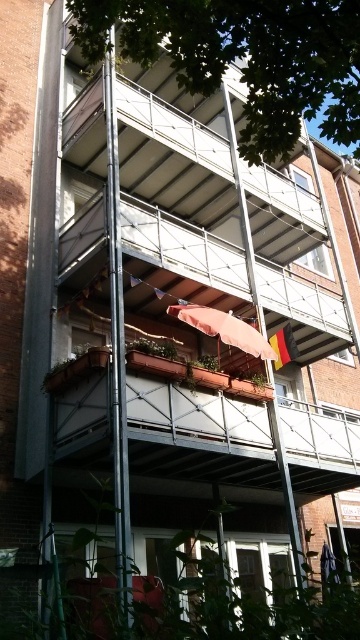
Question: Can you confirm if green leafy tree at upper center is positioned to the left of matte pink fabric canopy at center?

Choices:
 (A) yes
 (B) no

Answer: (A)

Question: Can you confirm if green leafy tree at upper center is positioned below matte pink fabric canopy at center?

Choices:
 (A) yes
 (B) no

Answer: (B)

Question: Which point appears farthest from the camera in this image?

Choices:
 (A) (281, 125)
 (B) (213, 321)

Answer: (B)

Question: Which object is closer to the camera taking this photo?

Choices:
 (A) green leafy tree at upper center
 (B) matte pink fabric canopy at center

Answer: (A)

Question: Does green leafy tree at upper center have a larger size compared to matte pink fabric canopy at center?

Choices:
 (A) yes
 (B) no

Answer: (A)